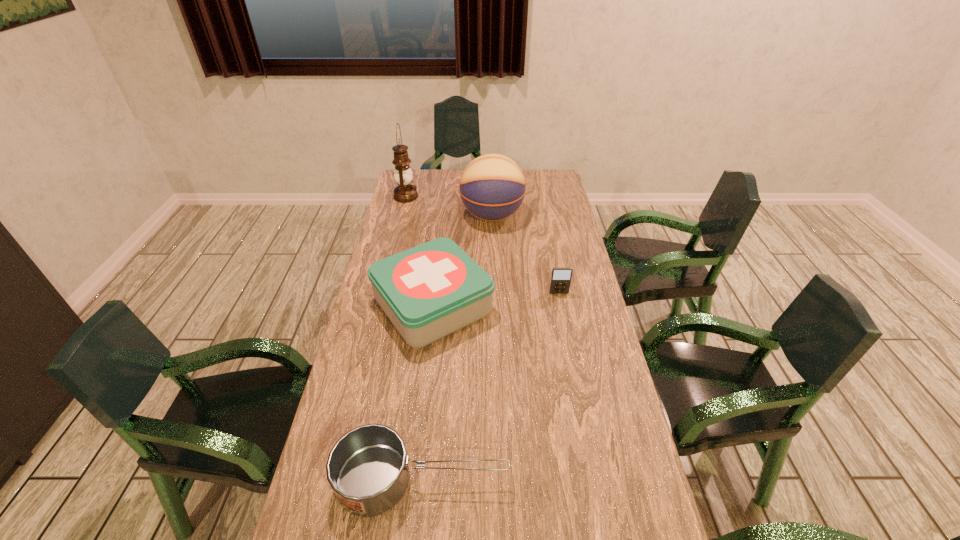
What are the coordinates of `oil lamp` in the screenshot? It's located at (405, 192).

Image resolution: width=960 pixels, height=540 pixels. Identify the location of basketball. (492, 187).

You are a GUI agent. You are given a task and a screenshot of the screen. Output one action in this format:
    pyautogui.click(x=<x>, y=<y>)
    Task: Click on the first-aid kit
    
    Given the screenshot: What is the action you would take?
    pyautogui.click(x=429, y=291)

This screenshot has height=540, width=960. In order to click on iPod in this screenshot , I will do `click(560, 282)`.

Identify the location of the nearest object. (367, 468).

Where is `free space located 0.110m on the back of the oil lamp`? The image size is (960, 540). free space located 0.110m on the back of the oil lamp is located at coordinates (411, 177).

Where is `vacant space located on the patterned surface of the basketball`? Image resolution: width=960 pixels, height=540 pixels. vacant space located on the patterned surface of the basketball is located at coordinates (435, 216).

This screenshot has width=960, height=540. In order to click on free region located on the patterned surface of the basketball in this screenshot , I will do `click(420, 216)`.

In order to click on free point located 0.170m on the patterned surface of the basketball in this screenshot , I will do `click(418, 216)`.

Find the location of a particular element. The image size is (960, 540). vacant space located on the right of the first-aid kit is located at coordinates (516, 305).